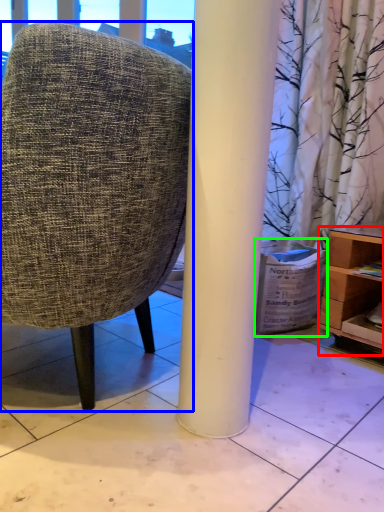
Question: Considering the real-world distances, which object is closest to shelf (highlighted by a red box)? chair (highlighted by a blue box) or cardboard box (highlighted by a green box).

Choices:
 (A) chair
 (B) cardboard box

Answer: (B)